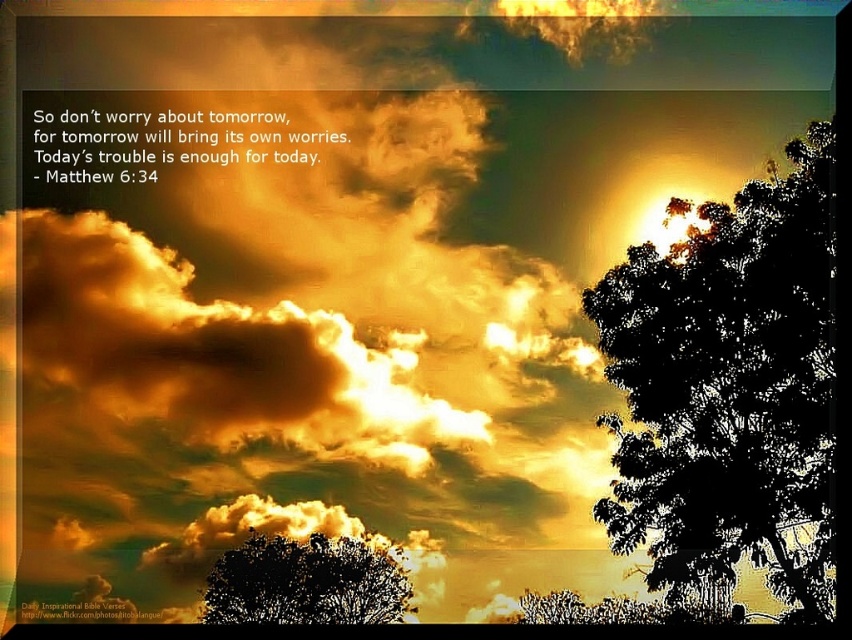
Question: Which of the following is the farthest from the observer?

Choices:
 (A) black leafy tree at right
 (B) dark green leafy tree at center

Answer: (B)

Question: Is black leafy tree at right above dark green leafy tree at center?

Choices:
 (A) no
 (B) yes

Answer: (B)

Question: Does black leafy tree at right appear on the right side of dark green leafy tree at center?

Choices:
 (A) yes
 (B) no

Answer: (A)

Question: Where is black leafy tree at right located in relation to dark green leafy tree at center in the image?

Choices:
 (A) left
 (B) right

Answer: (B)